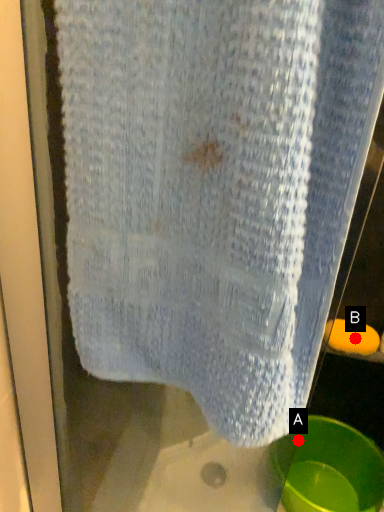
Question: Two points are circled on the image, labeled by A and B beside each circle. Which point is further to the camera?

Choices:
 (A) A is further
 (B) B is further

Answer: (A)